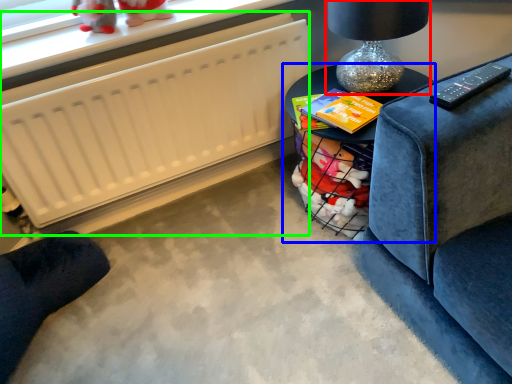
Question: Which object is the farthest from table lamp (highlighted by a red box)? Choose among these: table (highlighted by a blue box) or radiator (highlighted by a green box).

Choices:
 (A) table
 (B) radiator

Answer: (B)